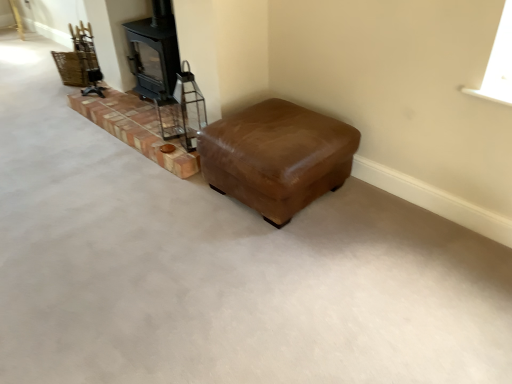
Question: Is brick at left wider or thinner than black matte wood burning stove at upper left?

Choices:
 (A) thin
 (B) wide

Answer: (B)

Question: From the image's perspective, is brick at left positioned above or below black matte wood burning stove at upper left?

Choices:
 (A) above
 (B) below

Answer: (B)

Question: Which object is positioned farthest from the brick at left?

Choices:
 (A) brown leather ottoman at center
 (B) black matte wood burning stove at upper left

Answer: (A)

Question: Estimate the real-world distances between objects in this image. Which object is farther from the brown leather ottoman at center?

Choices:
 (A) black matte wood burning stove at upper left
 (B) brick at left

Answer: (A)